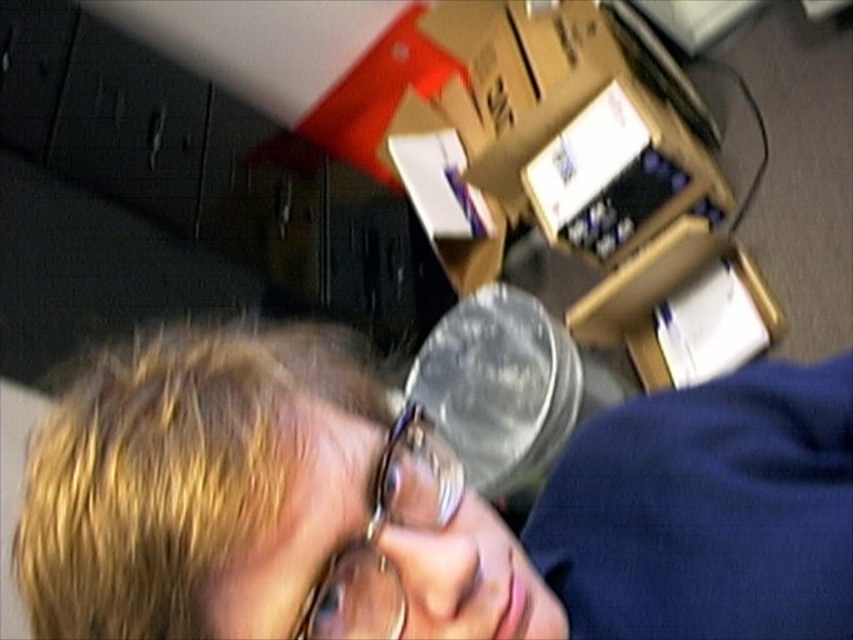
Question: Is clear plastic cup at center thinner than gold-rimmed glasses at center?

Choices:
 (A) yes
 (B) no

Answer: (B)

Question: Which point appears farthest from the camera in this image?

Choices:
 (A) (143, 508)
 (B) (436, 492)

Answer: (B)

Question: Which point is farther to the camera?

Choices:
 (A) (320, 618)
 (B) (126, 500)

Answer: (A)

Question: Among these points, which one is farthest from the camera?

Choices:
 (A) (389, 516)
 (B) (134, 460)
 (C) (798, 394)

Answer: (C)

Question: In this image, where is clear plastic cup at center located relative to blonde hair at center?

Choices:
 (A) left
 (B) right

Answer: (B)

Question: Where is blonde hair at center located in relation to gold-rimmed glasses at center in the image?

Choices:
 (A) above
 (B) below

Answer: (B)